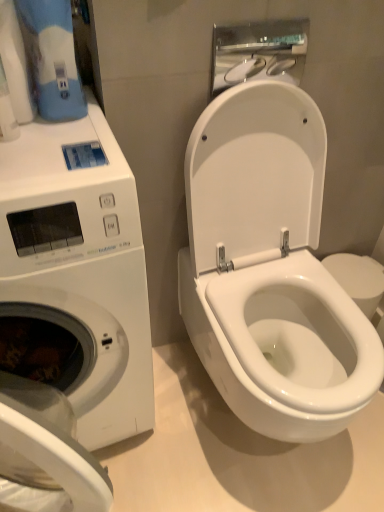
Where is `vacant area located to the right-hand side of white glossy toilet paper at upper left`? The width and height of the screenshot is (384, 512). vacant area located to the right-hand side of white glossy toilet paper at upper left is located at coordinates (74, 132).